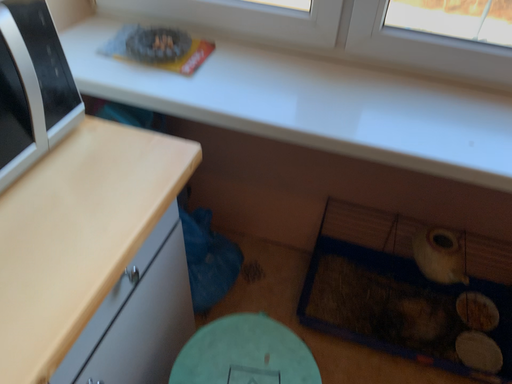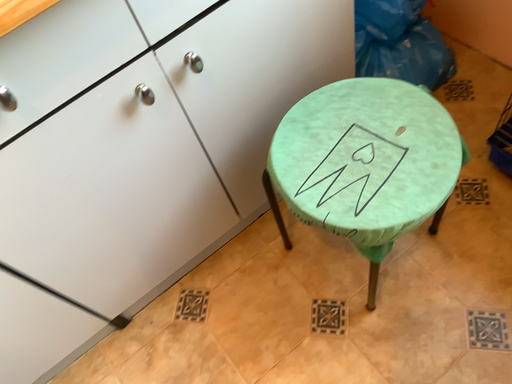
Question: Which way did the camera rotate in the video?

Choices:
 (A) rotated downward
 (B) rotated upward

Answer: (A)